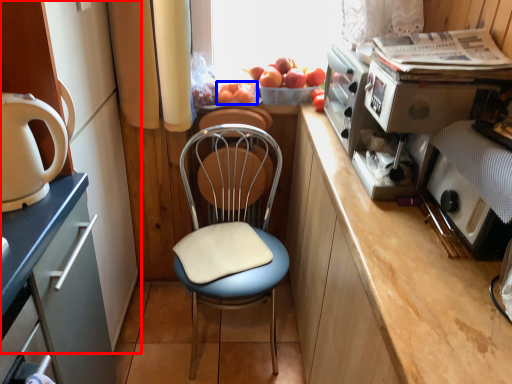
Question: Which object is further to the camera taking this photo, cabinetry (highlighted by a red box) or fruit (highlighted by a blue box)?

Choices:
 (A) cabinetry
 (B) fruit

Answer: (B)